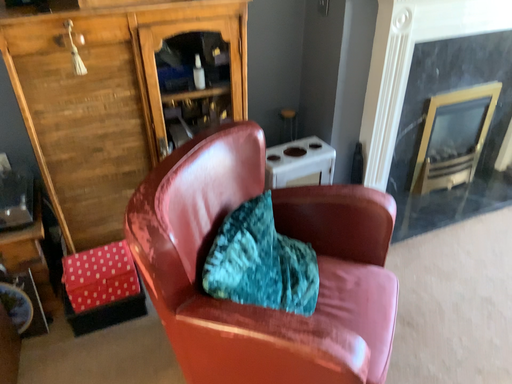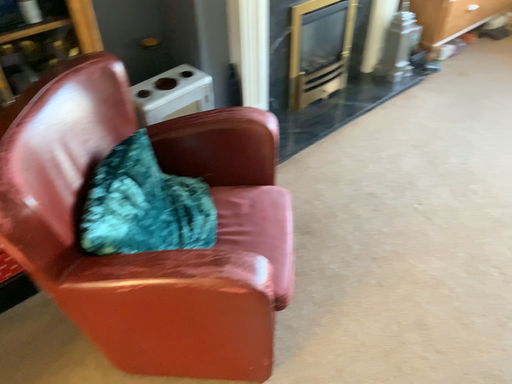
Question: How did the camera likely rotate when shooting the video?

Choices:
 (A) rotated downward
 (B) rotated upward

Answer: (A)